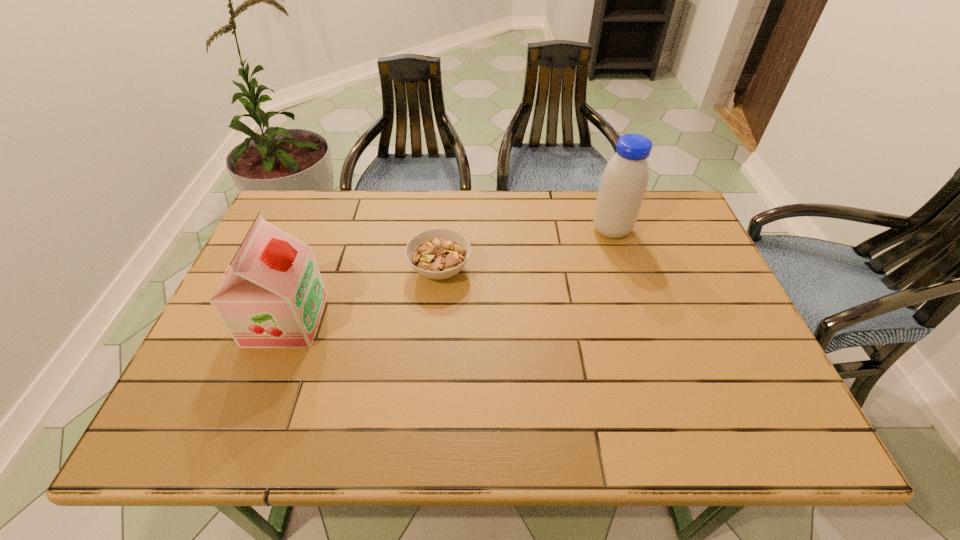
Where is `object at the left edge`? object at the left edge is located at coordinates (272, 295).

Image resolution: width=960 pixels, height=540 pixels. I want to click on free space at the far edge, so (x=502, y=216).

Locate an element on the screen. The height and width of the screenshot is (540, 960). vacant region at the near edge of the desktop is located at coordinates [317, 406].

Locate an element on the screen. The height and width of the screenshot is (540, 960). vacant position at the right edge of the desktop is located at coordinates (721, 354).

Identify the location of vacant region at the far left corner of the desktop. (300, 207).

Identify the location of free space at the far right corner of the desktop. click(x=649, y=213).

The height and width of the screenshot is (540, 960). Identify the location of vacant space at the near right corner. (721, 417).

In order to click on free space between the farthest object and the shortest object in this screenshot , I will do `click(526, 249)`.

Locate an element on the screen. The image size is (960, 540). blank region between the second object from right to left and the nearer soya milk is located at coordinates (363, 295).

The height and width of the screenshot is (540, 960). Identify the location of free spot between the shortest object and the rightmost object. (526, 249).